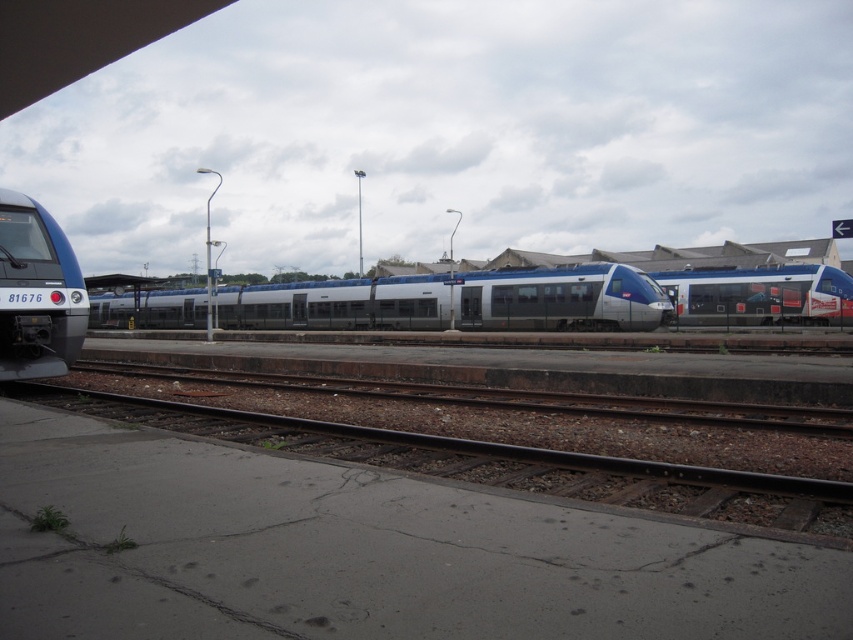
Question: Which point is farther from the camera taking this photo?

Choices:
 (A) (347, 282)
 (B) (165, 406)

Answer: (A)

Question: In this image, where is silver metallic train at center located relative to silver metallic train at right?

Choices:
 (A) left
 (B) right

Answer: (A)

Question: Which of the following is the closest to the observer?

Choices:
 (A) (549, 493)
 (B) (82, 328)

Answer: (A)

Question: Is brown gravel track at lower center further to the viewer compared to silver metallic train at center?

Choices:
 (A) no
 (B) yes

Answer: (A)

Question: Can you confirm if blue glossy train at left is positioned to the right of silver metallic train at right?

Choices:
 (A) no
 (B) yes

Answer: (A)

Question: Which of the following is the closest to the observer?

Choices:
 (A) (167, 403)
 (B) (618, 266)
 (C) (805, 276)

Answer: (A)